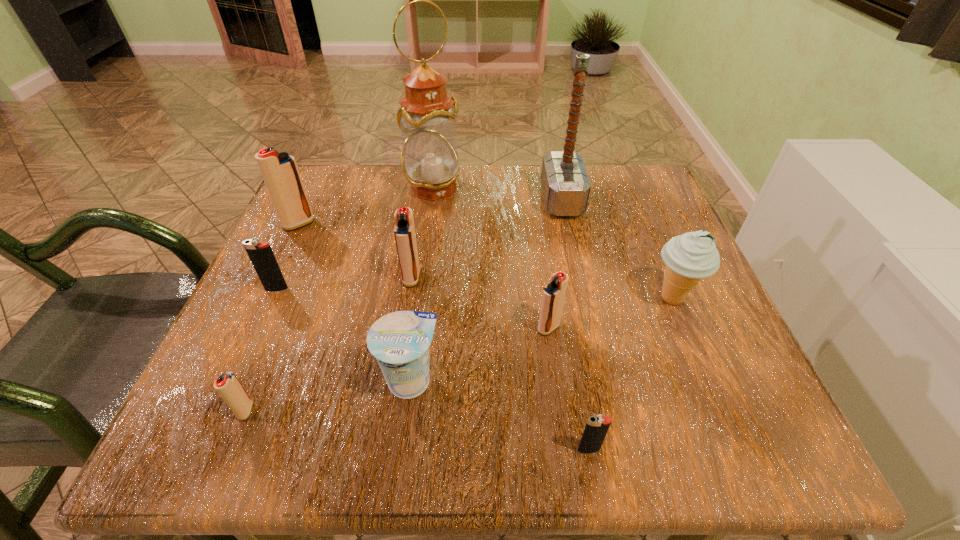
The width and height of the screenshot is (960, 540). Find the location of `the tallest object`. the tallest object is located at coordinates (429, 158).

The width and height of the screenshot is (960, 540). What are the coordinates of `hammer` in the screenshot? It's located at (565, 184).

Locate an element on the screen. the ninth shortest object is located at coordinates (565, 184).

You are a GUI agent. You are given a task and a screenshot of the screen. Output one action in this format:
    pyautogui.click(x=<x>, y=<y>)
    Task: Click on the leftmost red igniter
    This screenshot has width=960, height=540.
    Given the screenshot: What is the action you would take?
    pyautogui.click(x=280, y=172)

Locate an element on the screen. the biggest red igniter is located at coordinates (280, 172).

I want to click on icecream, so click(x=689, y=257).

Find the location of a particular element. the rightmost object is located at coordinates (689, 257).

Locate an element on the screen. This screenshot has width=960, height=540. the third igniter from right to left is located at coordinates (405, 237).

Where is `the third nearest red igniter`? Image resolution: width=960 pixels, height=540 pixels. the third nearest red igniter is located at coordinates (405, 237).

Identify the location of the left black igniter. (261, 255).